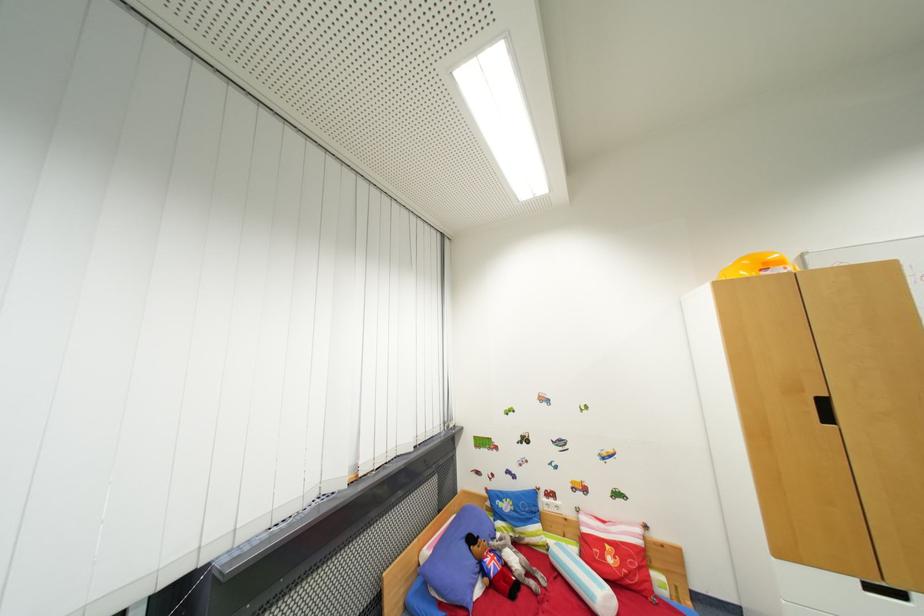
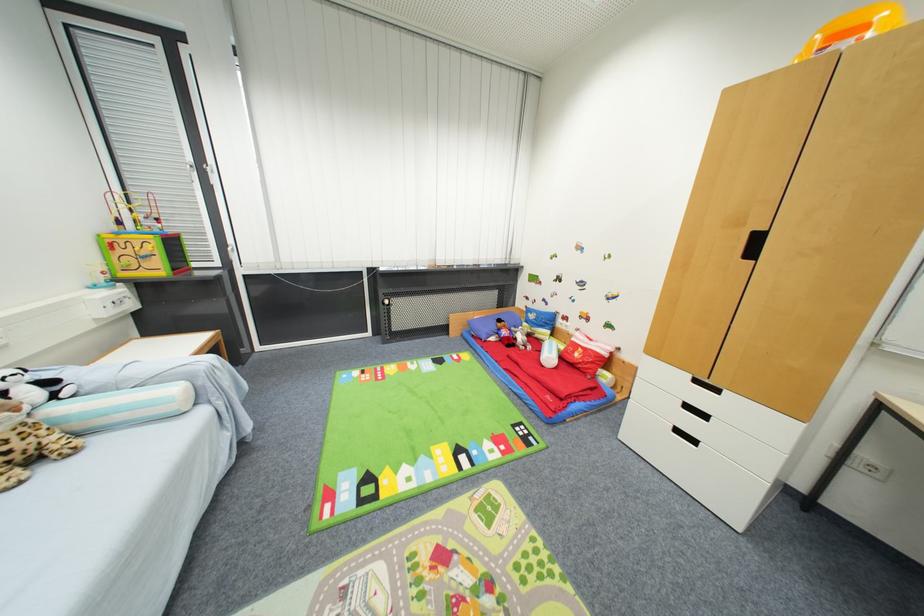
Where in the second image is the point corresponding to the point at 477,541 from the first image?

(505, 323)